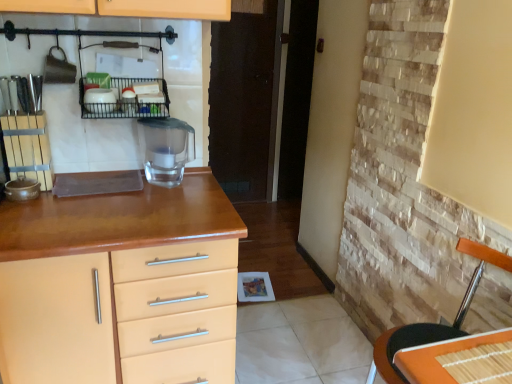
You are a GUI agent. You are given a task and a screenshot of the screen. Output one action in this format:
    pyautogui.click(x=<x>, y=<y>)
    Task: Click on the vacant area that is situated to the right of transparent glass water filter at center
    Image resolution: width=512 pixels, height=384 pixels.
    Given the screenshot: What is the action you would take?
    pyautogui.click(x=205, y=187)